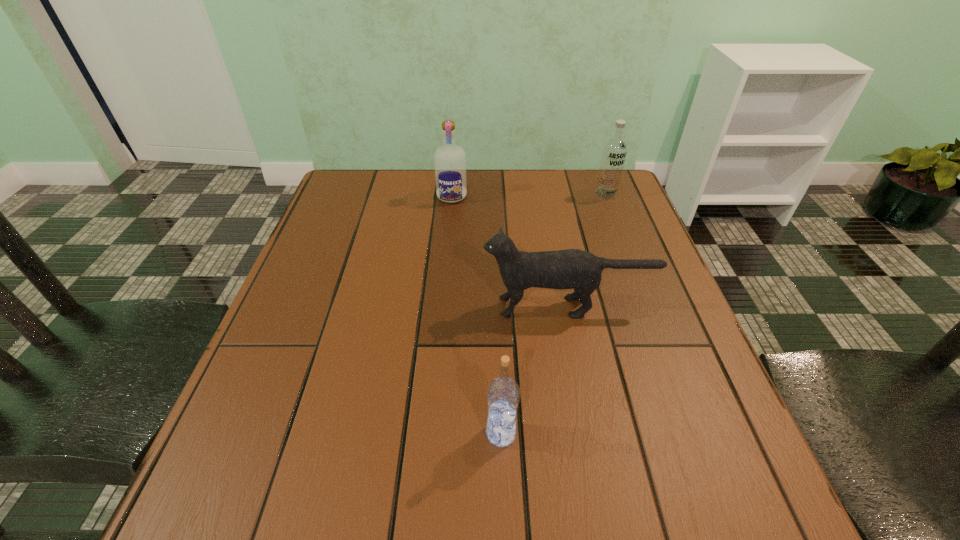
Identify the location of unoccupied position between the rightmost vodka and the second nearest object. This screenshot has width=960, height=540. (587, 250).

The image size is (960, 540). Identify the location of empty space that is in between the rightmost vodka and the cat. (587, 250).

You are a GUI agent. You are given a task and a screenshot of the screen. Output one action in this format:
    pyautogui.click(x=<x>, y=<y>)
    Task: Click on the empty space that is in between the nearest object and the cat
    The height and width of the screenshot is (540, 960).
    Given the screenshot: What is the action you would take?
    pyautogui.click(x=534, y=370)

Where is `empty location between the rightmost vodka and the cat`? This screenshot has width=960, height=540. empty location between the rightmost vodka and the cat is located at coordinates pyautogui.click(x=587, y=250).

Identify the location of free space between the second vodka from right to left and the leftmost vodka. (476, 315).

You are a GUI agent. You are given a task and a screenshot of the screen. Output one action in this format:
    pyautogui.click(x=<x>, y=<y>)
    Task: Click on the free space that is in between the rightmost vodka and the leftmost vodka
    This screenshot has width=960, height=540.
    Given the screenshot: What is the action you would take?
    pyautogui.click(x=529, y=195)

Locate an element on the screen. The width and height of the screenshot is (960, 540). free point between the rightmost vodka and the nearest vodka is located at coordinates (553, 314).

Locate an element on the screen. Image resolution: width=960 pixels, height=540 pixels. empty location between the rightmost vodka and the second nearest object is located at coordinates (587, 250).

Image resolution: width=960 pixels, height=540 pixels. I want to click on empty space between the leftmost object and the nearest object, so click(x=476, y=315).

Identify the location of the closest object relative to the leftmost vodka. (576, 269).